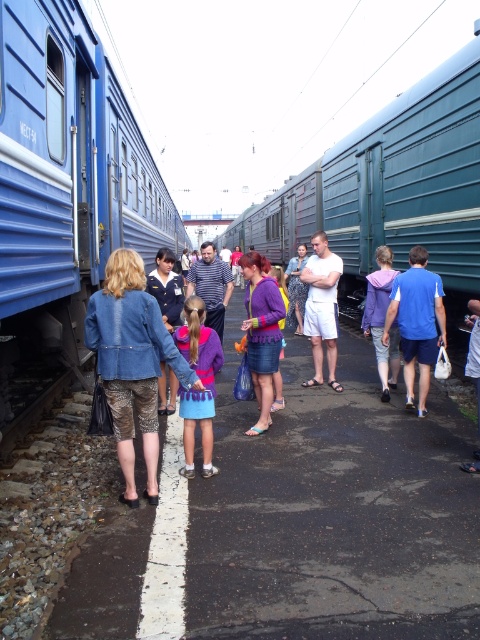
You are standing on the train platform and want to take a photo of both point [417,301] and point [261,332] in the scene. Which point should you focus on first to ensure both are in clear view?

You should focus on point [417,301] first because it is closer to the camera than point [261,332]. This ensures both points will be in focus as the depth of field will cover the distance between them.

You are a passenger waiting at the train station. You notice two people in the crowd wearing a blue fabric shirt at right and a purple matte sweater at center. Which clothing item is positioned lower in the scene?

The blue fabric shirt at right is below the purple matte sweater at center, so the blue fabric shirt at right is positioned lower in the scene.